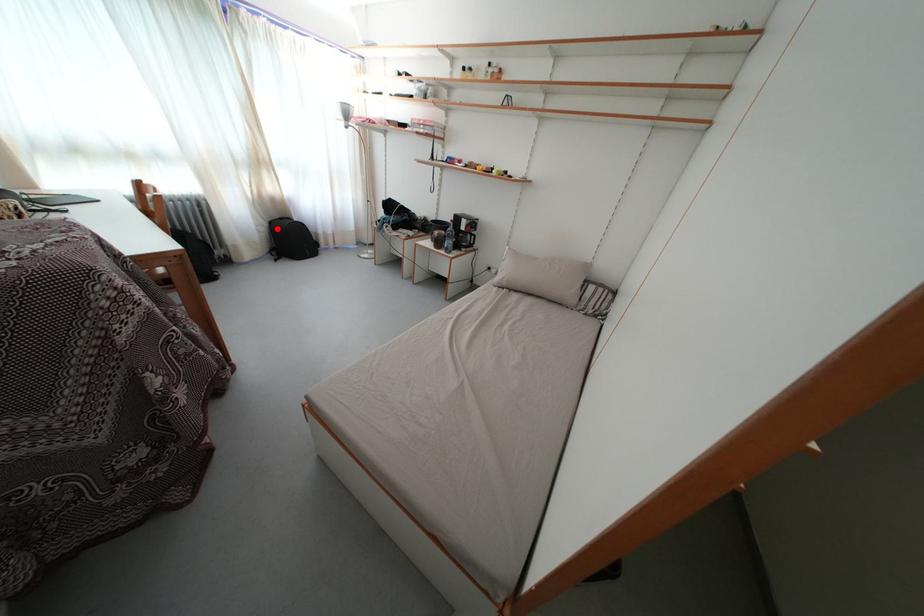
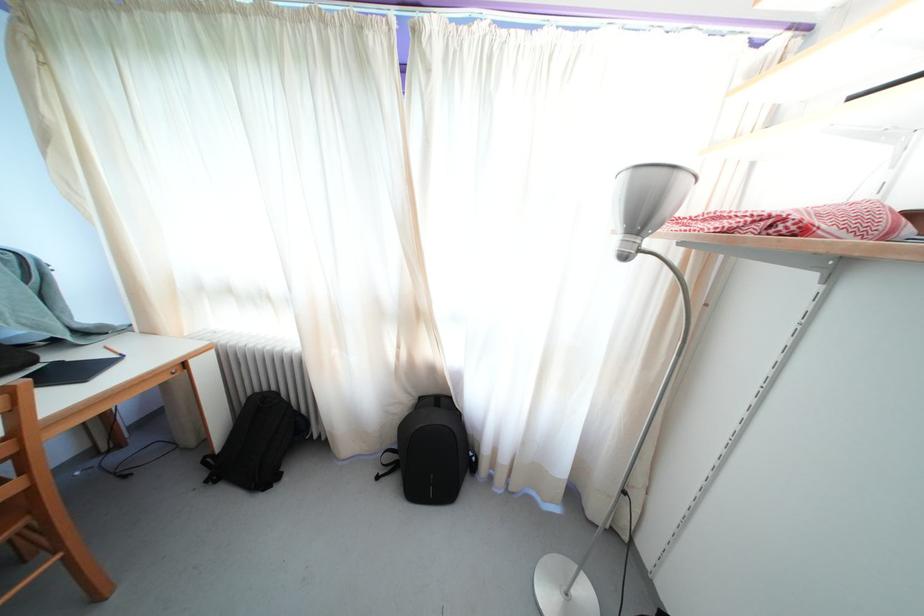
Question: I am providing you with two images of the same scene from different viewpoints. Given a red point in image1, look at the same physical point in image2. Is it:

Choices:
 (A) Closer to the viewpoint
 (B) Farther from the viewpoint

Answer: (B)